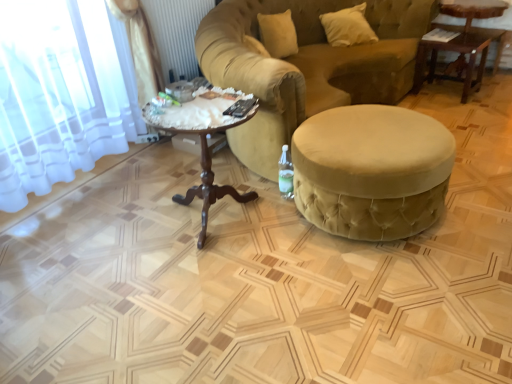
Locate an element on the screen. The width and height of the screenshot is (512, 384). free area in between mahogany wood coffee table at center and clear glass bottle at lower right is located at coordinates (260, 191).